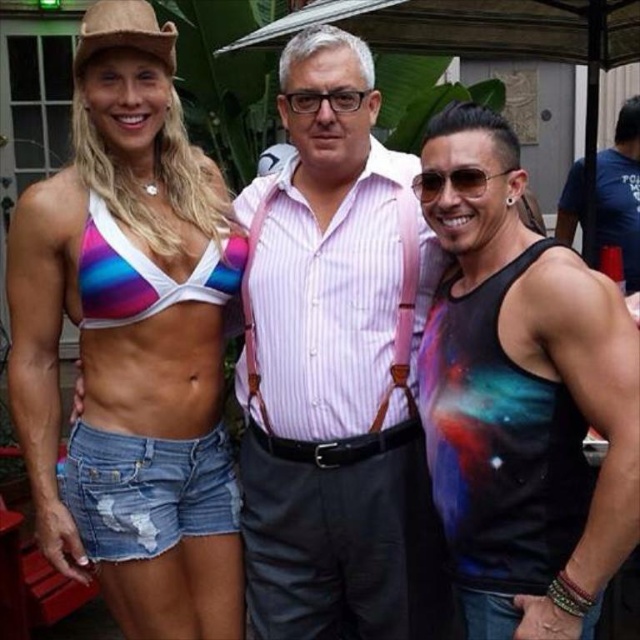
You are a photographer trying to capture the rainbow fabric bikini top at upper left in your shot. Based on the coordinates provided, where should you position your camera to ensure it is centered in the frame?

To center the rainbow fabric bikini top at upper left, position your camera so that the center of the frame aligns with the coordinates point (131, 340).

You are a photographer setting up a shot for a fashion magazine. You need to ensure that the rainbow fabric bikini top at upper left and the denim shorts at lower left are both in frame. Based on their positions, which object should you focus on first to capture both in the shot?

The rainbow fabric bikini top at upper left should be focused on first since it is positioned to the left of the denim shorts at lower left, ensuring both are captured in the frame.